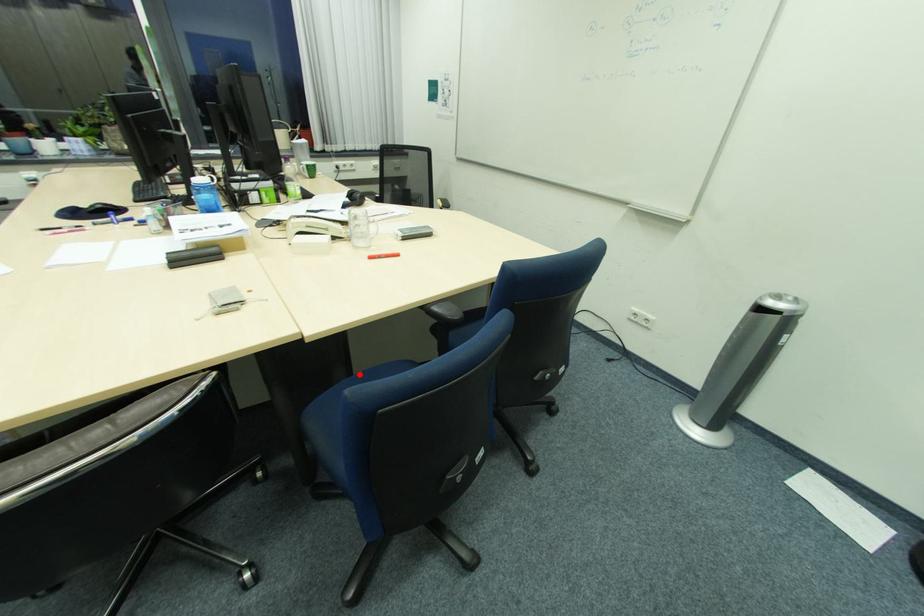
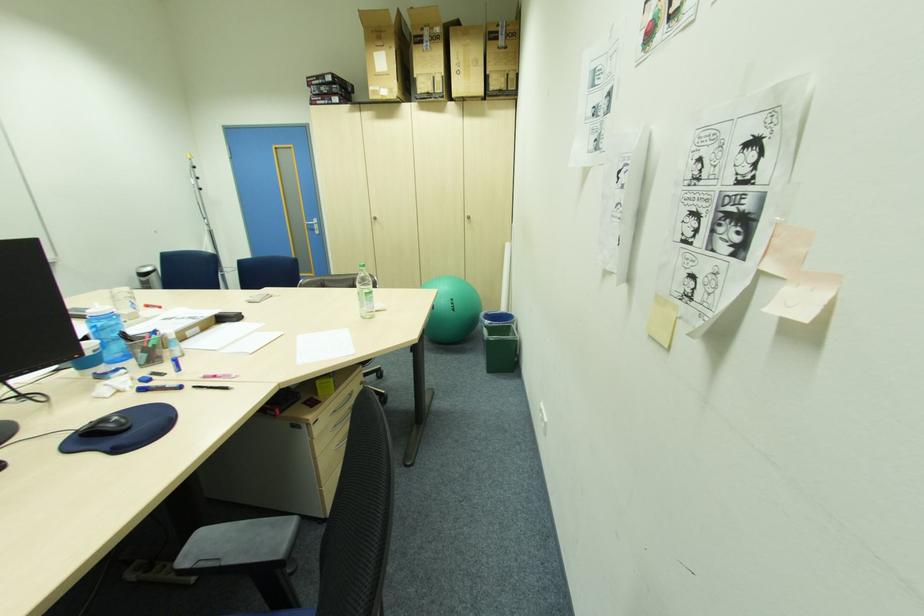
Question: I am providing you with two images of the same scene from different viewpoints. A red point is marked on the first image. At the location where the point appears in image 1, is it still visible in image 2?

Choices:
 (A) Yes
 (B) No

Answer: (B)